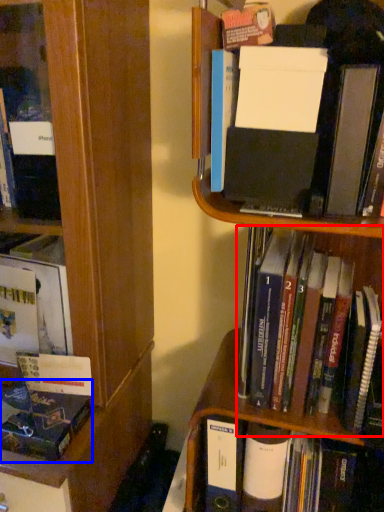
Question: Among these objects, which one is farthest to the camera, book (highlighted by a red box) or book (highlighted by a blue box)?

Choices:
 (A) book
 (B) book

Answer: (B)